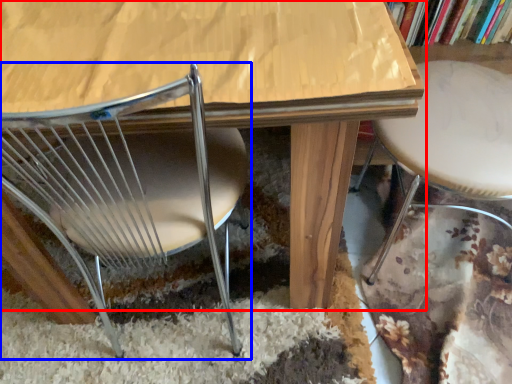
Question: Which point is further to the camera, table (highlighted by a red box) or chair (highlighted by a blue box)?

Choices:
 (A) table
 (B) chair

Answer: (A)